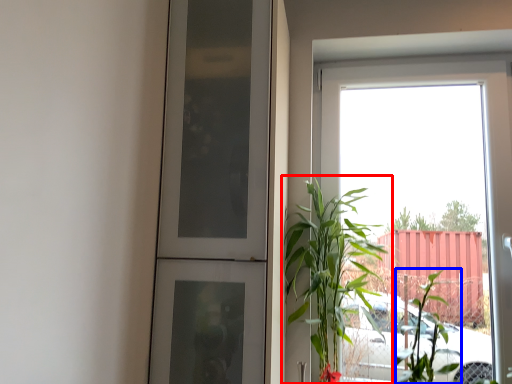
Question: Which object is further to the camera taking this photo, houseplant (highlighted by a red box) or plant (highlighted by a blue box)?

Choices:
 (A) houseplant
 (B) plant

Answer: (B)